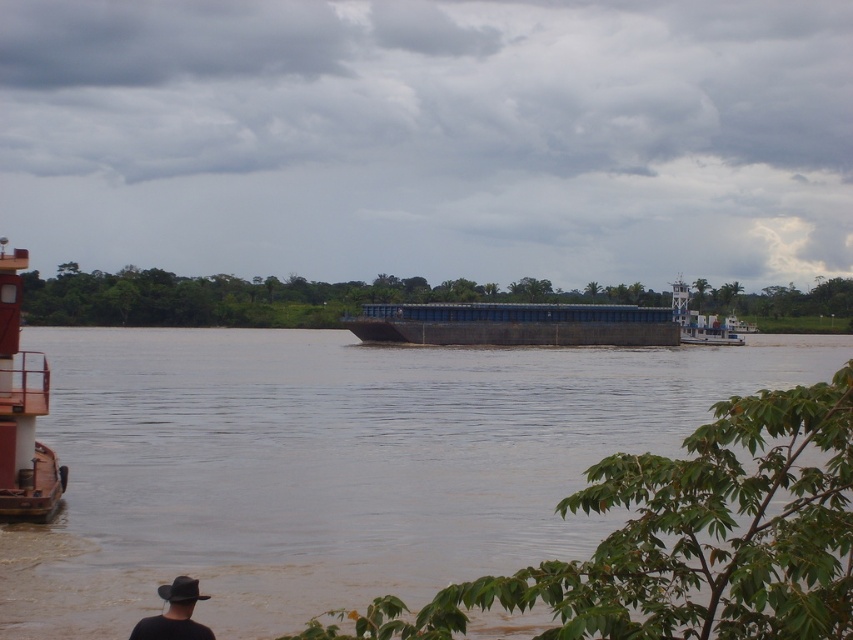
Question: Which object appears closest to the camera in this image?

Choices:
 (A) dark blue matte barge at center
 (B) black leather hat at lower left
 (C) brown matte river at center

Answer: (B)

Question: Which point appears closest to the camera in this image?

Choices:
 (A) (177, 632)
 (B) (404, 440)
 (C) (631, 337)
 (D) (16, 273)

Answer: (A)

Question: Can you confirm if brown matte river at center is smaller than black leather hat at lower left?

Choices:
 (A) yes
 (B) no

Answer: (B)

Question: Which point is farther from the camera taking this photo?

Choices:
 (A) (146, 404)
 (B) (469, 317)

Answer: (B)

Question: Can you confirm if brown matte river at center is positioned to the left of dark blue matte barge at center?

Choices:
 (A) yes
 (B) no

Answer: (A)

Question: Does rustic wood barge at left have a greater width compared to black leather hat at lower left?

Choices:
 (A) yes
 (B) no

Answer: (A)